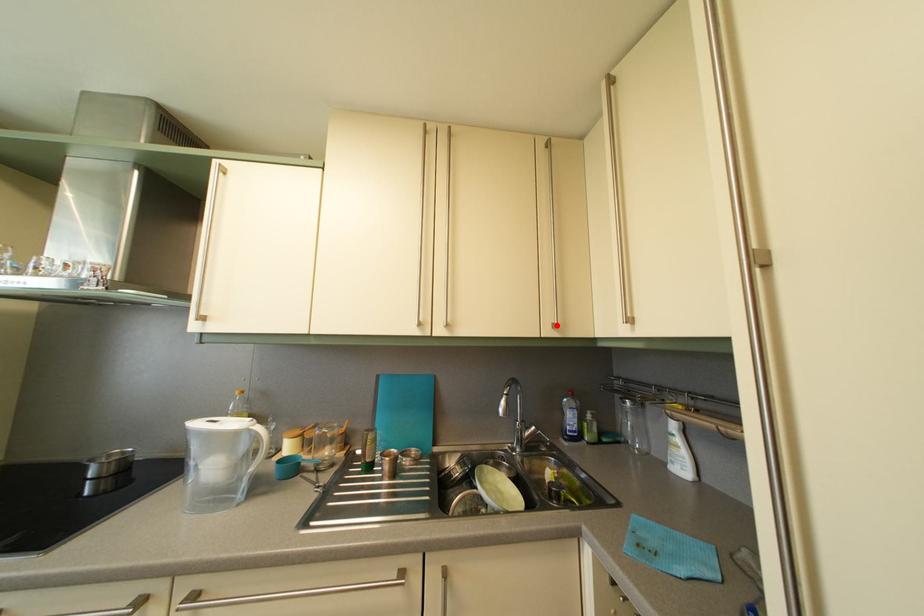
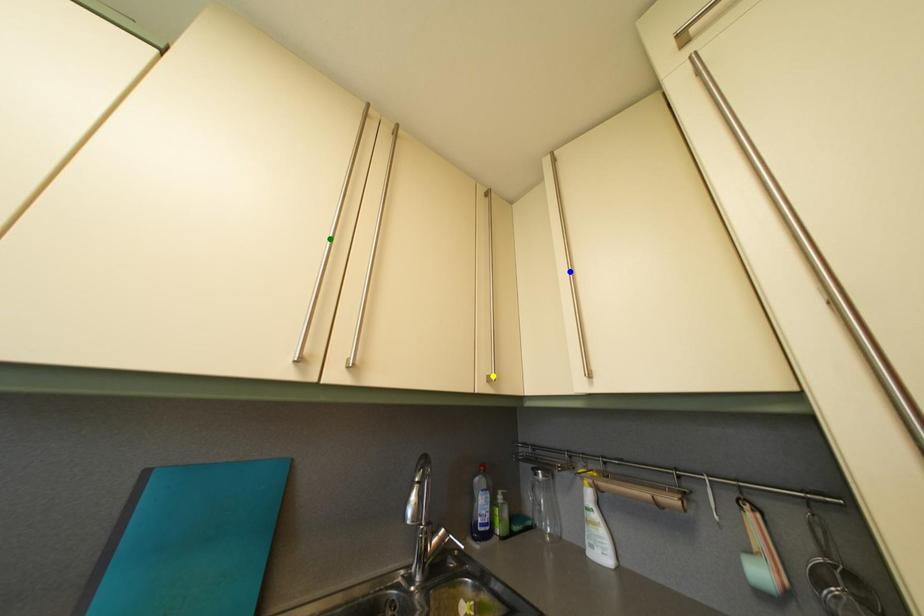
Question: I am providing you with two images of the same scene from different viewpoints. A red point is marked on the first image. You are given multiple points on the second image. Which point in image 2 is actually the same real-world point as the red point in image 1?

Choices:
 (A) green point
 (B) yellow point
 (C) blue point

Answer: (B)